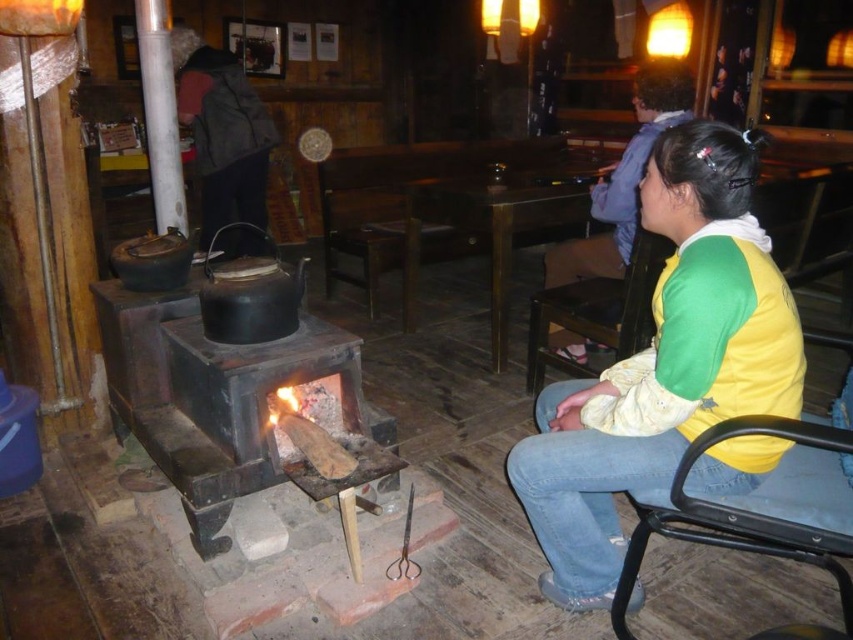
You are standing in the rustic cafe and want to take a photo of the two points mentioned. Which point, point (624, 256) or point (610, 355), will appear larger in your camera view?

Point (624, 256) will appear larger in your camera view because it is closer to the camera than point (610, 355).